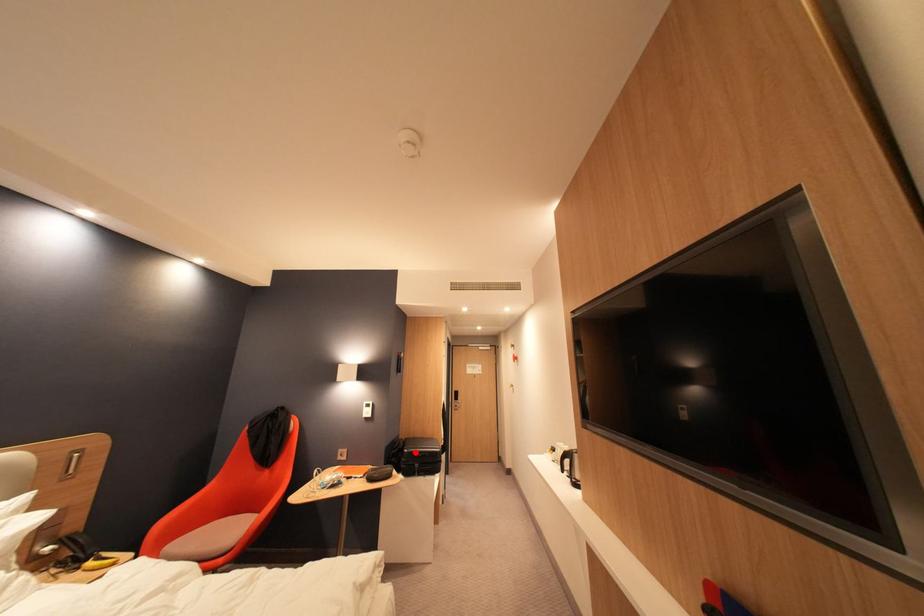
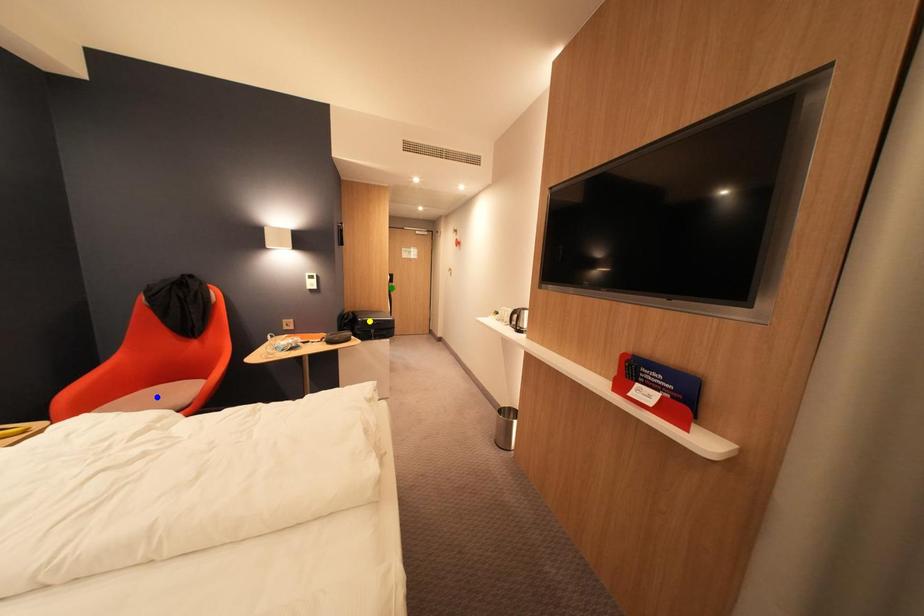
Question: I am providing you with two images of the same scene from different viewpoints. A red point is marked on the first image. You are given multiple points on the second image. Which spot in image 2 lines up with the point in image 1?

Choices:
 (A) blue point
 (B) green point
 (C) yellow point

Answer: (C)